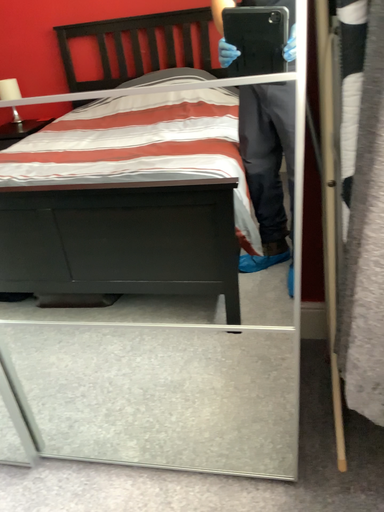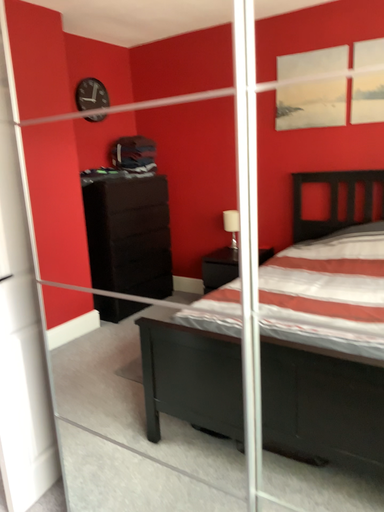
Question: How did the camera likely rotate when shooting the video?

Choices:
 (A) rotated right
 (B) rotated left

Answer: (B)